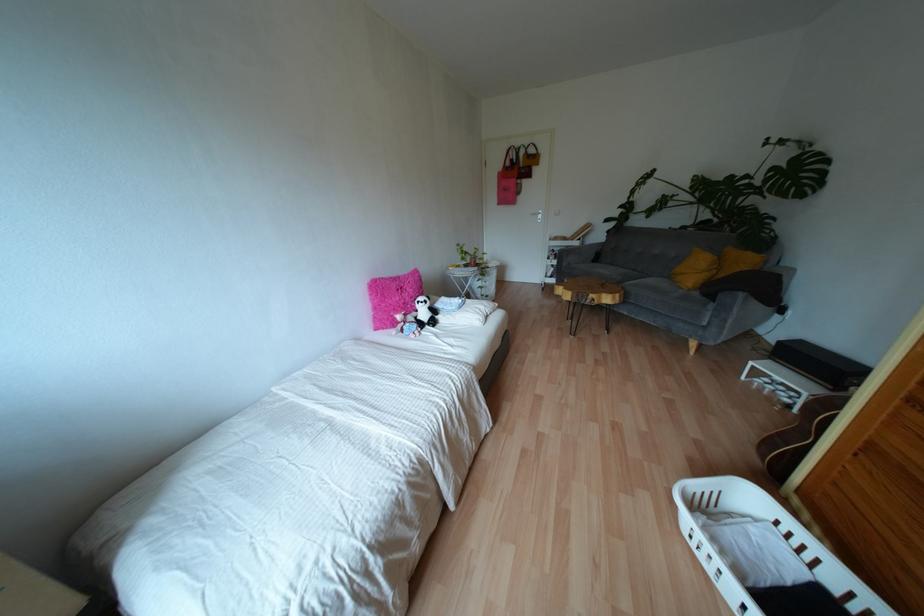
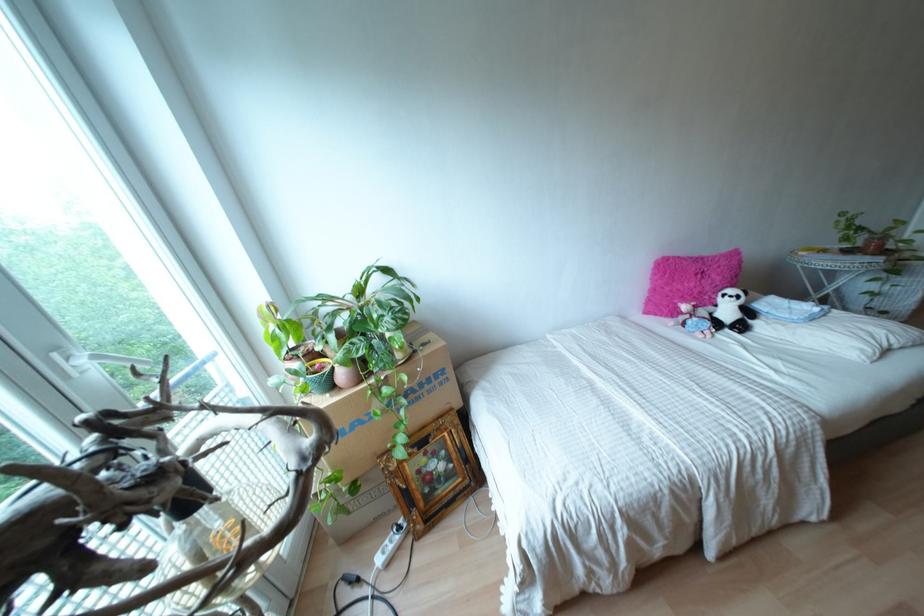
The point at (383, 304) is marked in the first image. Where is the corresponding point in the second image?

(666, 288)